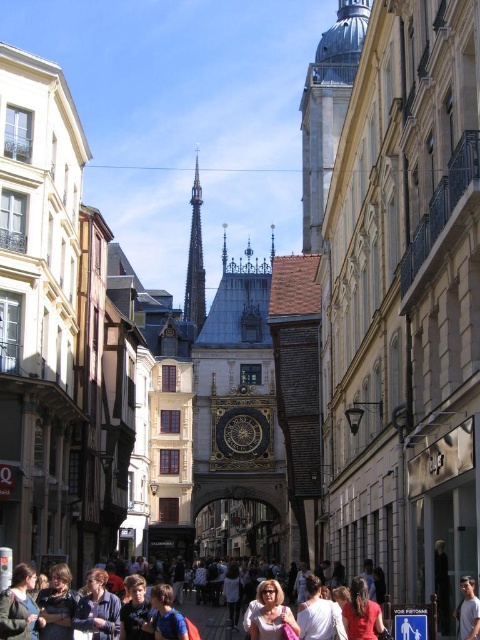
You are a street vendor standing at the base of the clock tower. You notice two jackets hanging on a rack to your left. Which jacket is shorter in height between the green fabric jacket at lower left and the denim jacket at lower left?

The green fabric jacket at lower left is shorter in height compared to the denim jacket at lower left.

You are standing on the street looking at the clock tower. There are two points marked on the ground in front of you. The first point is at coordinates point (x=143, y=602) and the second point is at point (x=168, y=584). Which point is closer to you?

Point (x=143, y=602) is in front of point (x=168, y=584), so it is closer to you.

You are a tailor observing two jackets in a busy European street scene. The green fabric jacket at lower left and the light brown leather jacket at center. Which jacket would require less fabric to make?

The green fabric jacket at lower left requires less fabric to make because it is thinner than the light brown leather jacket at center.